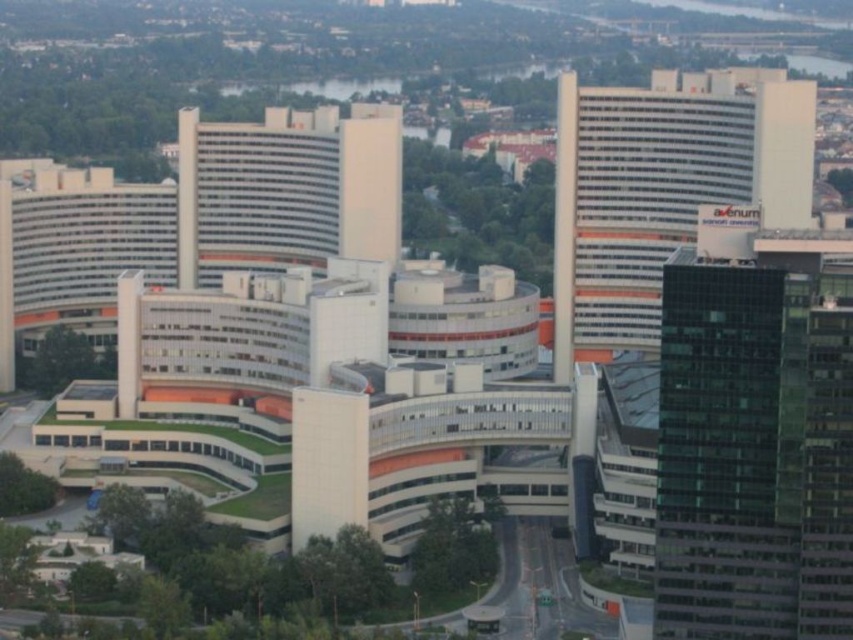
Question: Estimate the real-world distances between objects in this image. Which object is farther from the white glossy building at center?

Choices:
 (A) green glass skyscraper at right
 (B) white glass building at center

Answer: (A)

Question: Considering the relative positions of green glass skyscraper at right and white glass building at center in the image provided, where is green glass skyscraper at right located with respect to white glass building at center?

Choices:
 (A) below
 (B) above

Answer: (A)

Question: Observing the image, what is the correct spatial positioning of green glass skyscraper at right in reference to white glass building at center?

Choices:
 (A) above
 (B) below

Answer: (B)

Question: From the image, what is the correct spatial relationship of green glass skyscraper at right in relation to white glass building at center?

Choices:
 (A) below
 (B) above

Answer: (A)

Question: Which point is closer to the camera?

Choices:
 (A) (253, 237)
 (B) (602, 202)
 (C) (834, 388)

Answer: (C)

Question: Which of the following is the closest to the observer?

Choices:
 (A) (763, 410)
 (B) (619, 170)
 (C) (215, 264)

Answer: (A)